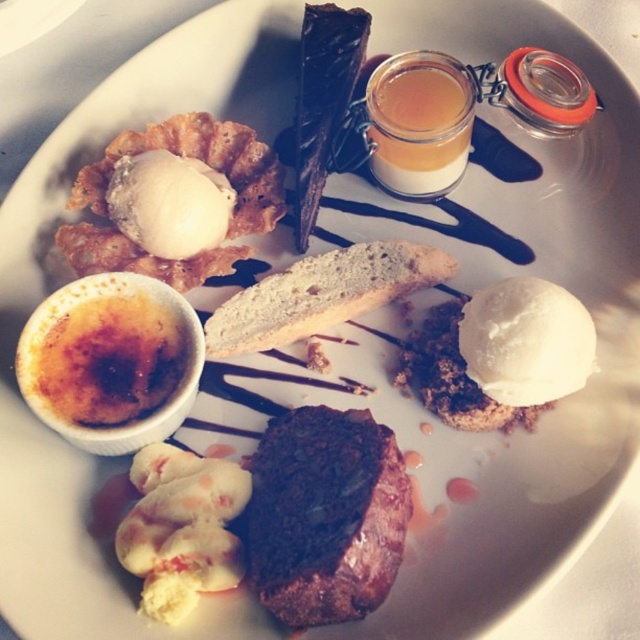
Question: Which of the following is the closest to the observer?

Choices:
 (A) (240, 189)
 (B) (433, 84)
 (C) (308, 102)

Answer: (B)

Question: Which object is closer to the camera taking this photo?

Choices:
 (A) white creamy ice cream at upper left
 (B) dark chocolate cake at center

Answer: (B)

Question: Which is farther from the dark chocolate cake at center?

Choices:
 (A) white creamy pastry at center-left
 (B) white creamy ice cream at upper left

Answer: (B)

Question: Is dark chocolate cake at center behind white crumbly biscotti at center?

Choices:
 (A) yes
 (B) no

Answer: (B)

Question: Can you confirm if white creamy pastry at center-left is positioned to the right of dark chocolate bar at upper center?

Choices:
 (A) yes
 (B) no

Answer: (B)

Question: Is white crumbly biscotti at center below translucent glass jar at upper center?

Choices:
 (A) no
 (B) yes

Answer: (B)